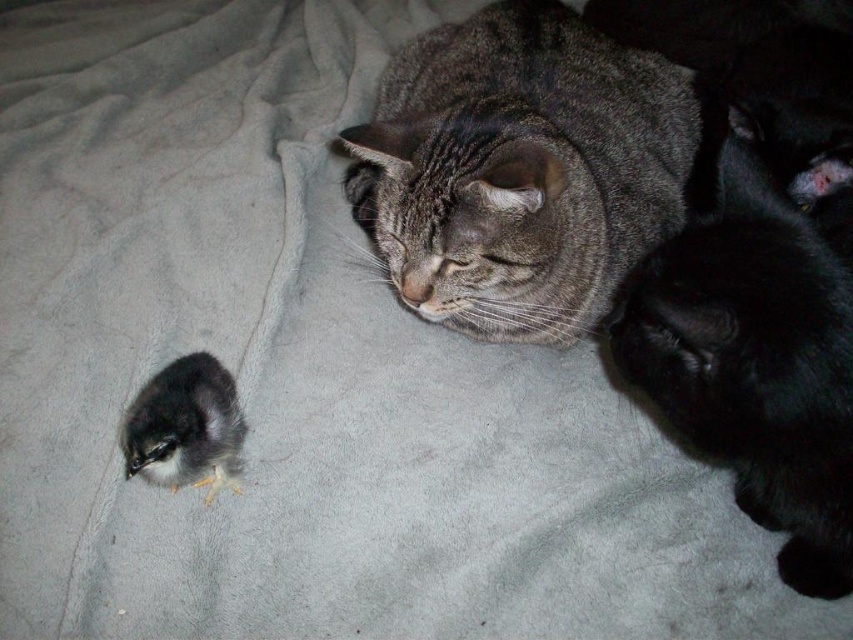
You are a pet owner who wants to place a small toy between the gray tabby cat at center and the black fur cat at right. Based on their positions, where should you place the toy so it is between them?

The gray tabby cat at center is above the black fur cat at right, so you should place the toy between them by positioning it in the middle area below the gray tabby cat at center and above the black fur cat at right.

You are a photographer trying to capture both the gray tabby cat at center and the silky black chick at lower left in the same frame. Given that your camera has a fixed focal length, which animal should you focus on to ensure both are in the frame without moving the camera?

Since the gray tabty cat at center is larger in width than the silky black chick at lower left, you should focus on the gray tabby cat at center to ensure both are in the frame without moving the camera.